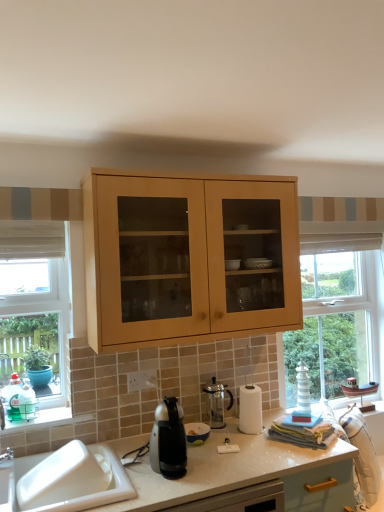
Where is `vacant point to the left of satin black coffee maker at center`? This screenshot has height=512, width=384. vacant point to the left of satin black coffee maker at center is located at coordinates pos(136,472).